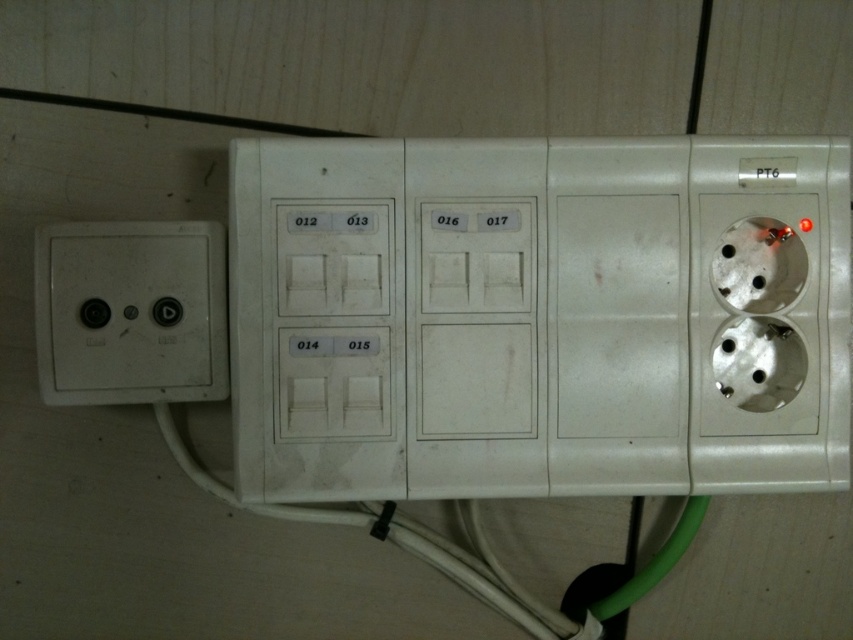
Question: Can you confirm if white plastic socket at center is thinner than white matte socket at left?

Choices:
 (A) no
 (B) yes

Answer: (A)

Question: Can you confirm if white plastic socket at center is thinner than white matte socket at left?

Choices:
 (A) no
 (B) yes

Answer: (A)

Question: Which point is closer to the camera?

Choices:
 (A) (x=416, y=189)
 (B) (x=187, y=314)

Answer: (B)

Question: Can you confirm if white plastic socket at center is smaller than white matte socket at left?

Choices:
 (A) yes
 (B) no

Answer: (B)

Question: Which point is farther from the camera taking this photo?

Choices:
 (A) (219, 337)
 (B) (543, 145)

Answer: (B)